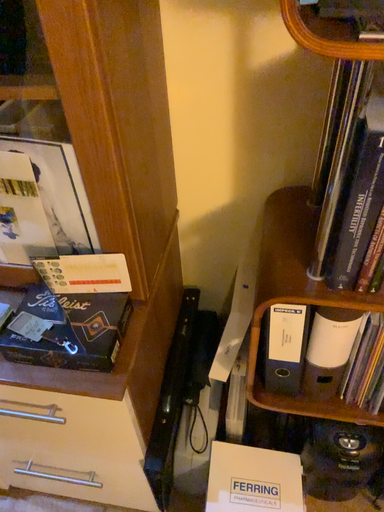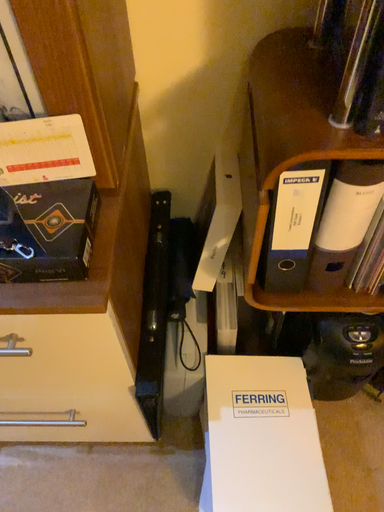
Question: How did the camera likely rotate when shooting the video?

Choices:
 (A) rotated upward
 (B) rotated downward

Answer: (B)